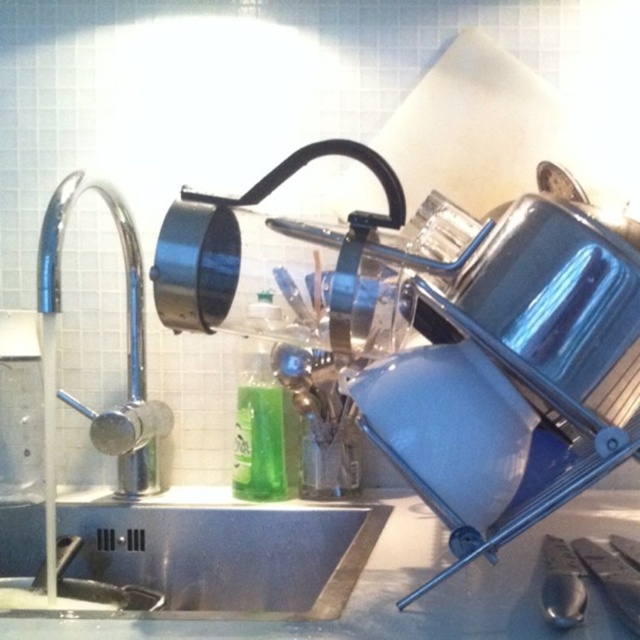
Question: Which object appears closest to the camera in this image?

Choices:
 (A) green translucent bottle at center
 (B) stainless steel sink at lower left

Answer: (B)

Question: Which point is closer to the camera?

Choices:
 (A) stainless steel sink at left
 (B) chrome/metallic faucet at left
 (C) stainless steel sink at lower left

Answer: (C)

Question: Is stainless steel sink at left to the right of stainless steel sink at lower left from the viewer's perspective?

Choices:
 (A) no
 (B) yes

Answer: (A)

Question: Can you confirm if stainless steel sink at left is positioned to the right of chrome/metallic faucet at left?

Choices:
 (A) yes
 (B) no

Answer: (A)

Question: Among these points, which one is nearest to the camera?

Choices:
 (A) (289, 595)
 (B) (74, 612)
 (C) (124, 458)
 (D) (278, 310)

Answer: (B)

Question: Does stainless steel sink at lower left come behind green translucent bottle at center?

Choices:
 (A) yes
 (B) no

Answer: (B)